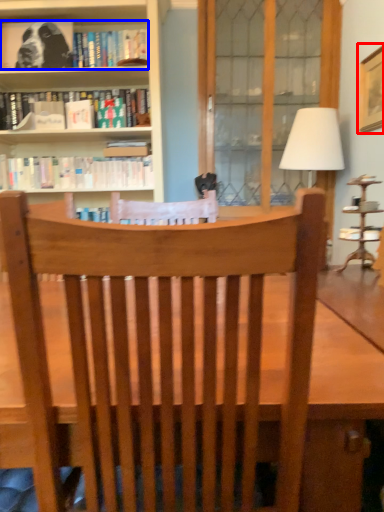
Question: Among these objects, which one is farthest to the camera, picture frame (highlighted by a red box) or book (highlighted by a blue box)?

Choices:
 (A) picture frame
 (B) book

Answer: (B)